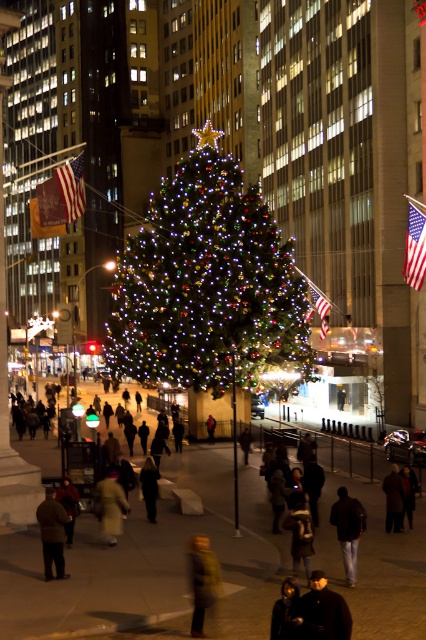
Question: Which object is farther from the camera taking this photo?

Choices:
 (A) dark brown coat at lower left
 (B) dark brown leather coat at lower center
 (C) dark gray fabric jacket at center

Answer: (A)

Question: Can you confirm if dark brown leather coat at lower center is smaller than dark gray coat at center?

Choices:
 (A) no
 (B) yes

Answer: (B)

Question: Which point is farther to the camera?

Choices:
 (A) yellow wool coat at center
 (B) green fuzzy coat at lower center

Answer: (A)

Question: Which point is closer to the camera taking this photo?

Choices:
 (A) (144, 470)
 (B) (359, 525)
 (C) (270, 228)

Answer: (B)

Question: Is illuminated glossy christmas tree at center closer to camera compared to dark brown leather jacket at lower center?

Choices:
 (A) no
 (B) yes

Answer: (A)

Question: Can you confirm if illuminated glossy christmas tree at center is positioned to the right of yellow wool coat at center?

Choices:
 (A) yes
 (B) no

Answer: (A)